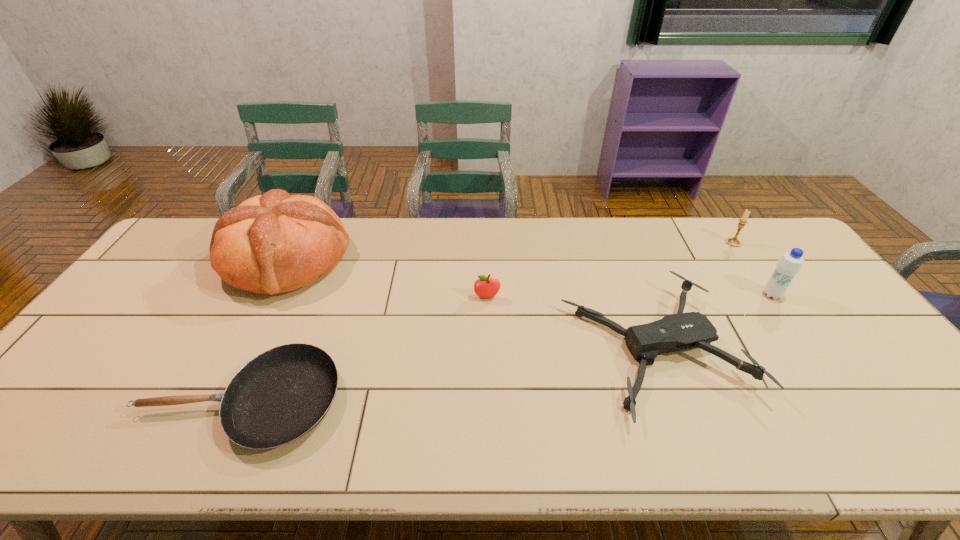
This screenshot has height=540, width=960. What are the coordinates of `free point located 0.100m on the right of the fourth shortest object` in the screenshot? It's located at (770, 242).

What are the coordinates of `vacant region located on the back of the fourth object from right to left` in the screenshot? It's located at (487, 257).

Identify the location of vacant space located on the back of the fifth tallest object. Image resolution: width=960 pixels, height=540 pixels. click(x=610, y=231).

Find the location of a particular element. This screenshot has width=960, height=540. vacant region located on the left of the shortest object is located at coordinates (69, 401).

Locate an element on the screen. This screenshot has height=540, width=960. bread that is at the far edge is located at coordinates tap(273, 243).

At what (x,y) coordinates should I click in order to perform the action: click on candle holder present at the far edge. Please return your answer as a coordinate pair (x, y). Looking at the image, I should click on (734, 242).

The height and width of the screenshot is (540, 960). I want to click on drone that is at the near edge, so click(x=675, y=332).

Find the location of a particular element. The width and height of the screenshot is (960, 540). frying pan that is at the near edge is located at coordinates (280, 395).

Find the location of a particular element. This screenshot has height=540, width=960. water bottle present at the right edge is located at coordinates tap(790, 264).

Image resolution: width=960 pixels, height=540 pixels. Identify the location of candle holder located at the right edge. (734, 242).